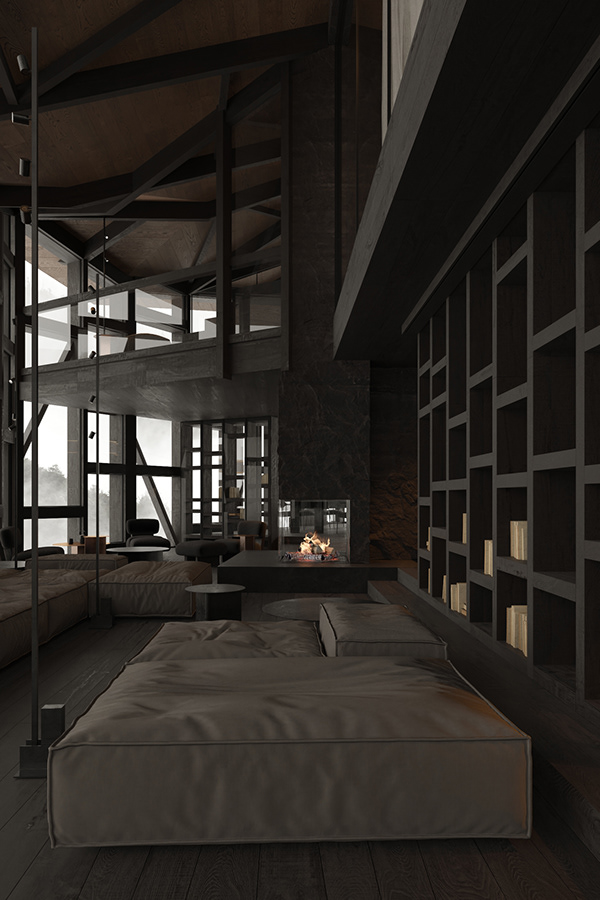
Image resolution: width=600 pixels, height=900 pixels. Identify the location of wooden floor. (321, 864), (99, 650), (251, 605).